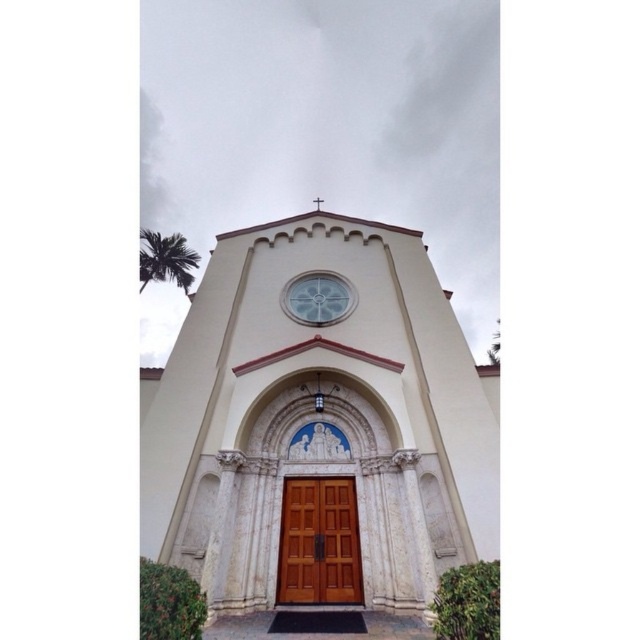
Question: Which point is closer to the camera taking this photo?

Choices:
 (A) (285, 595)
 (B) (333, 289)
 (C) (237, 316)

Answer: (A)

Question: Which point is farther from the camera taking this photo?

Choices:
 (A) (353, 592)
 (B) (234, 442)
 (C) (312, 301)

Answer: (C)

Question: Can you confirm if smooth beige stone church at center is positioned to the right of clear glass clock at center?

Choices:
 (A) yes
 (B) no

Answer: (B)

Question: Is smooth beige stone church at center to the right of clear glass clock at center from the viewer's perspective?

Choices:
 (A) no
 (B) yes

Answer: (A)

Question: Estimate the real-world distances between objects in this image. Which object is closer to the clear glass clock at center?

Choices:
 (A) wooden door at center
 (B) smooth beige stone church at center

Answer: (B)

Question: Does smooth beige stone church at center have a larger size compared to clear glass clock at center?

Choices:
 (A) no
 (B) yes

Answer: (B)